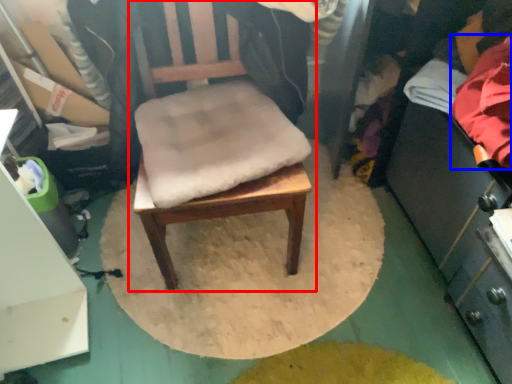
Question: Among these objects, which one is nearest to the camera, chair (highlighted by a red box) or clothing (highlighted by a blue box)?

Choices:
 (A) chair
 (B) clothing

Answer: (A)